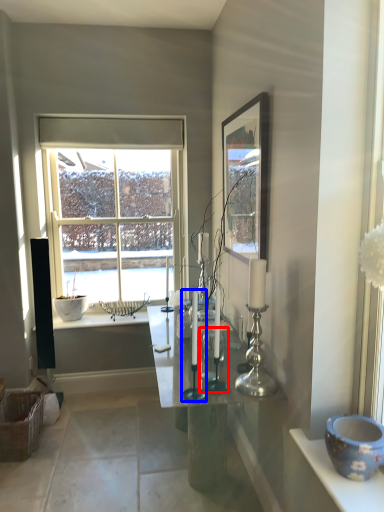
Question: Which of the following is the closest to the observer, candle holder (highlighted by a red box) or candle holder (highlighted by a blue box)?

Choices:
 (A) candle holder
 (B) candle holder

Answer: (B)